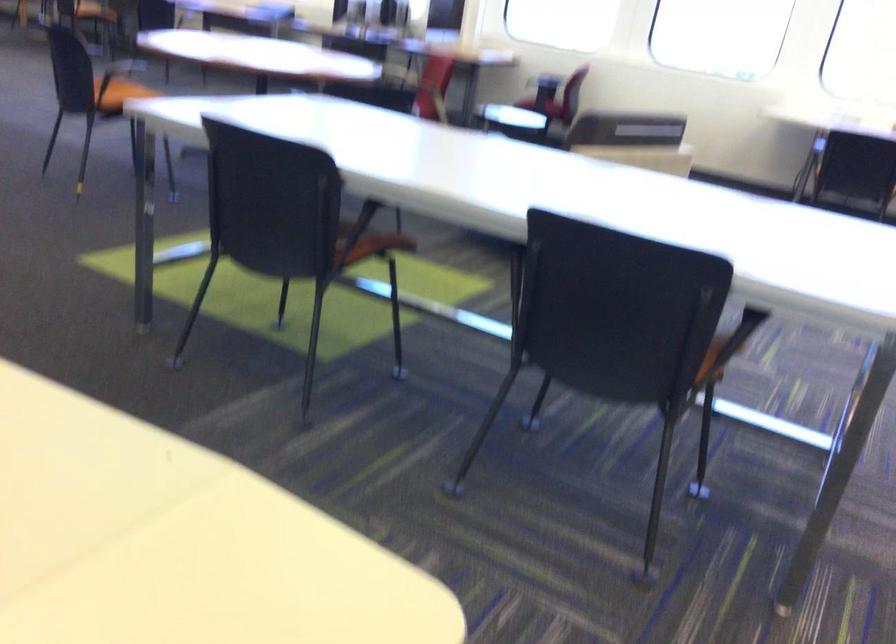
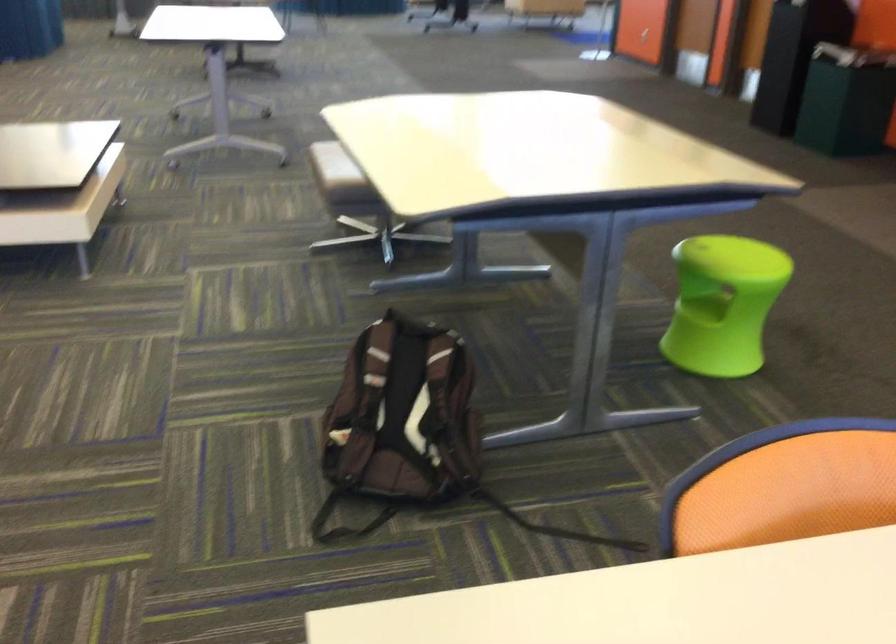
In the second image, find the point that corresponds to pixel 669 245 in the first image.

(832, 585)